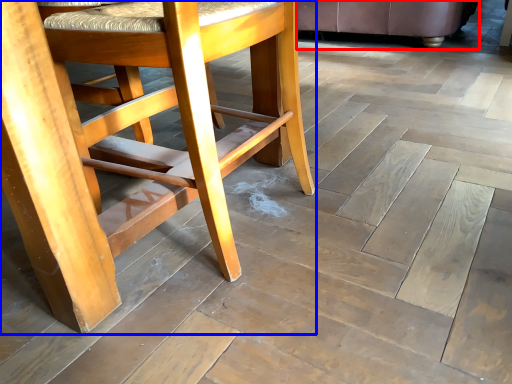
Question: Among these objects, which one is nearest to the camera, chair (highlighted by a red box) or chair (highlighted by a blue box)?

Choices:
 (A) chair
 (B) chair

Answer: (B)